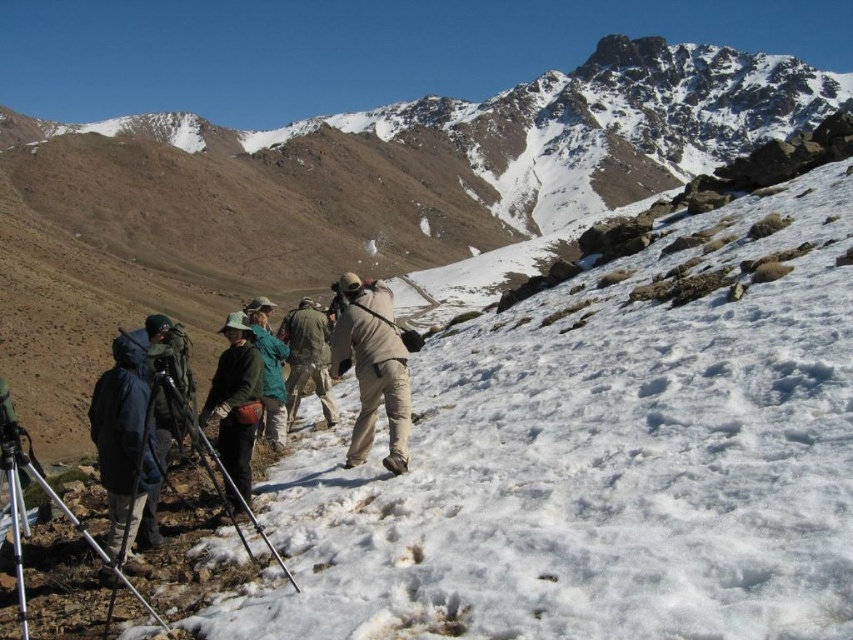
Who is lower down, dark blue fabric jacket at lower left or silver metallic tripod at lower left?

silver metallic tripod at lower left is lower down.

Describe the element at coordinates (125, 442) in the screenshot. I see `dark blue fabric jacket at lower left` at that location.

Locate an element on the screen. dark blue fabric jacket at lower left is located at coordinates (125, 442).

Is point (369, 280) positioned behind point (277, 397)?

Yes, point (369, 280) is farther from viewer.

Who is more forward, (387, 296) or (265, 369)?

Point (265, 369) is in front.

Measure the distance between tan fabric backpack at center and camera.

The distance of tan fabric backpack at center from camera is 58.96 meters.

Locate an element on the screen. tan fabric backpack at center is located at coordinates (372, 368).

Who is higher up, dark blue fabric jacket at lower left or brushed metal backpack at lower left?

brushed metal backpack at lower left is above.

At what (x,y) coordinates should I click in order to perform the action: click on dark blue fabric jacket at lower left. Please return your answer as a coordinate pair (x, y). Looking at the image, I should click on (125, 442).

You are a GUI agent. You are given a task and a screenshot of the screen. Output one action in this format:
    pyautogui.click(x=<x>, y=<y>)
    Task: Click on the dark blue fabric jacket at lower left
    This screenshot has height=640, width=853.
    Given the screenshot: What is the action you would take?
    pyautogui.click(x=125, y=442)